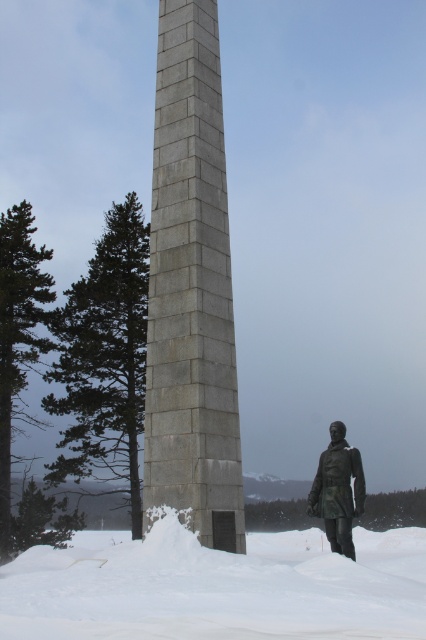
You are a visitor at the monument and want to take a photo of the bronze statue at lower right without any snow in the background. Is the white fluffy snow at lower center blocking the view of the statue?

The white fluffy snow at lower center is positioned under bronze statue at lower right, so it is blocking the view of the statue. You will need to move to a different angle to avoid the snow.

You are standing in front of the obelisk monument and want to determine which of the two points, point 1 at coordinates (192, 40) or point 2 at coordinates (402, 616), is closer to you. Based on the scene description, which point is closer?

Point 1 at coordinates (192, 40) is closer to you because it is further to the viewer than point 2 at coordinates (402, 616).